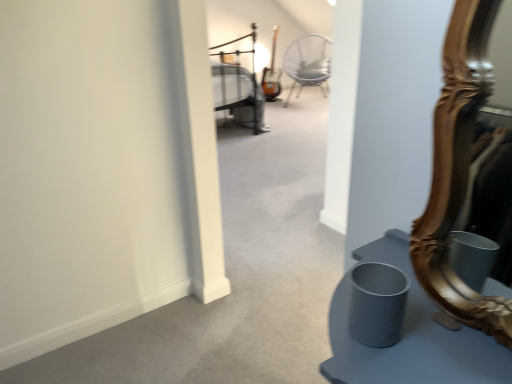
Question: From a real-world perspective, is gold carved mirror at right physically located above or below metallic silver bed at upper center?

Choices:
 (A) below
 (B) above

Answer: (B)

Question: From the image's perspective, is gold carved mirror at right above or below metallic silver bed at upper center?

Choices:
 (A) below
 (B) above

Answer: (A)

Question: Considering the real-world distances, which object is farthest from the metallic silver chair at center?

Choices:
 (A) metallic silver bed at upper center
 (B) gold carved mirror at right

Answer: (B)

Question: Which of these objects is positioned closest to the gold carved mirror at right?

Choices:
 (A) metallic silver chair at center
 (B) metallic silver bed at upper center

Answer: (B)